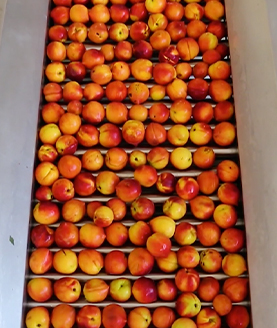
Where is `table`? table is located at coordinates (260, 81), (13, 180).